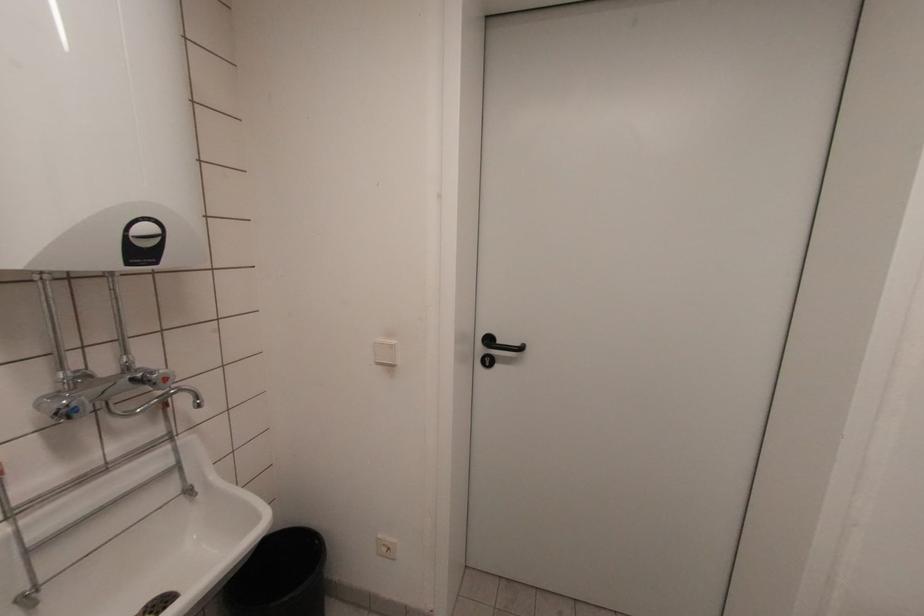
Where would you push the white light switch? Please return your answer as a coordinate pair (x, y).

(384, 352)